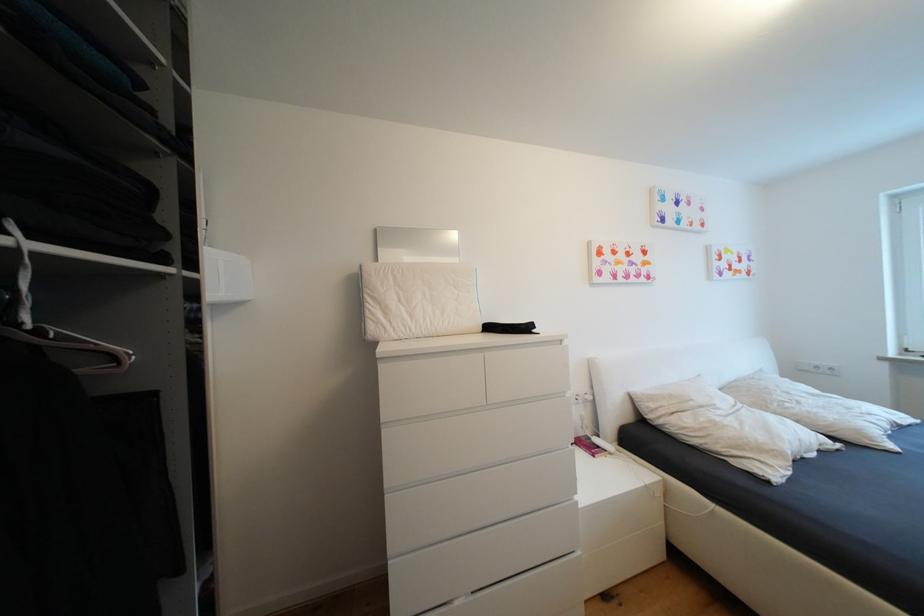
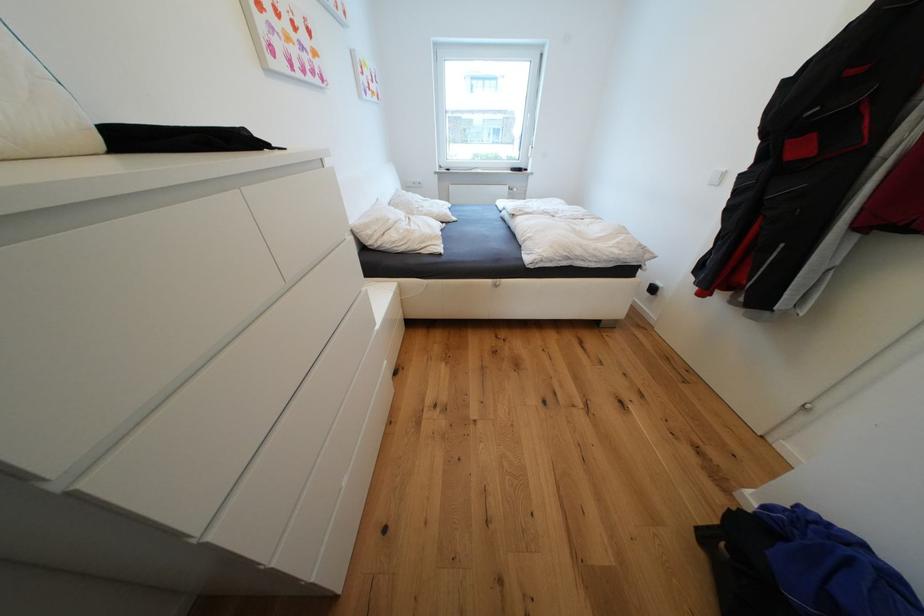
The point at (x=660, y=407) is marked in the first image. Where is the corresponding point in the second image?

(377, 233)